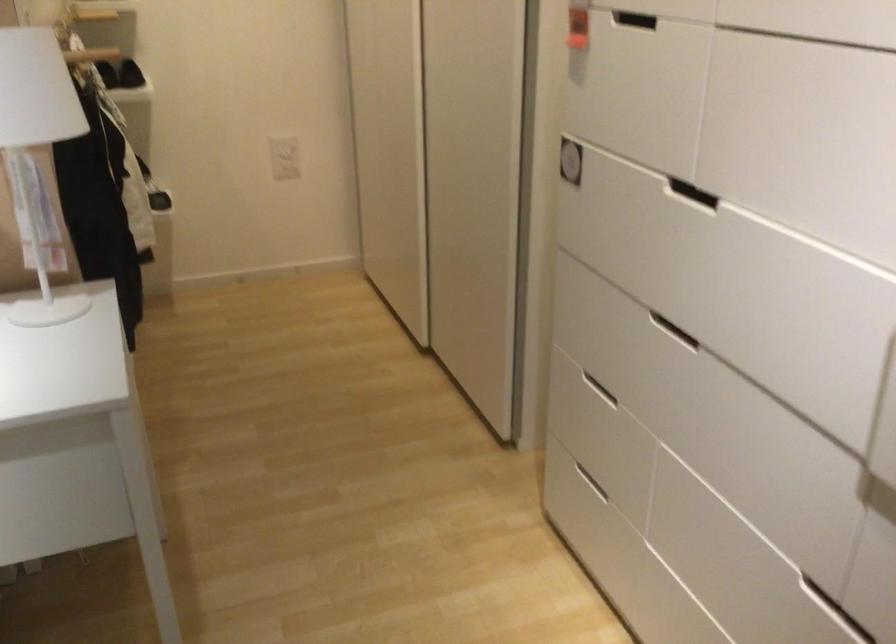
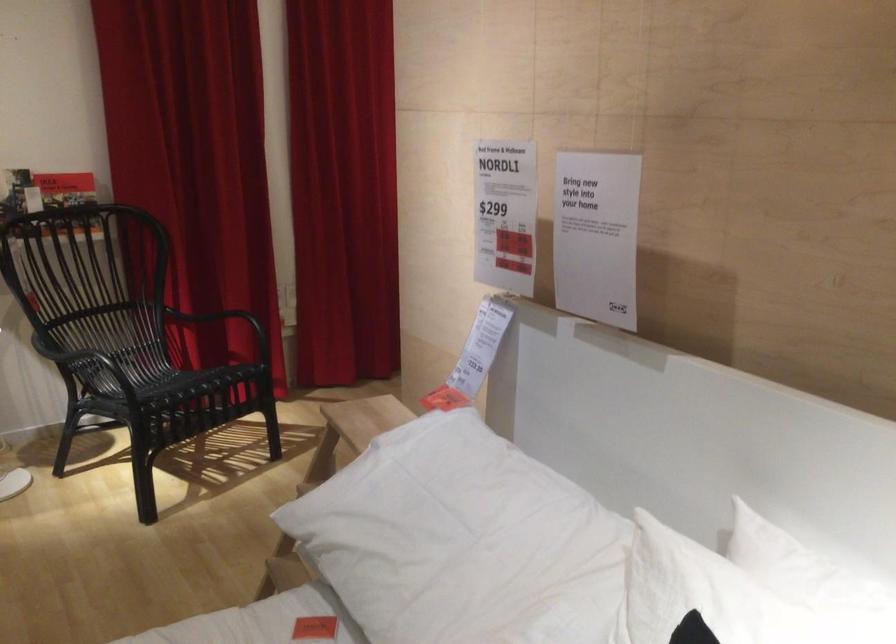
Question: The camera is either moving clockwise (left) or counter-clockwise (right) around the object. The first image is from the beginning of the video and the second image is from the end. Is the camera moving left or right when shooting the video?

Choices:
 (A) Left
 (B) Right

Answer: (B)